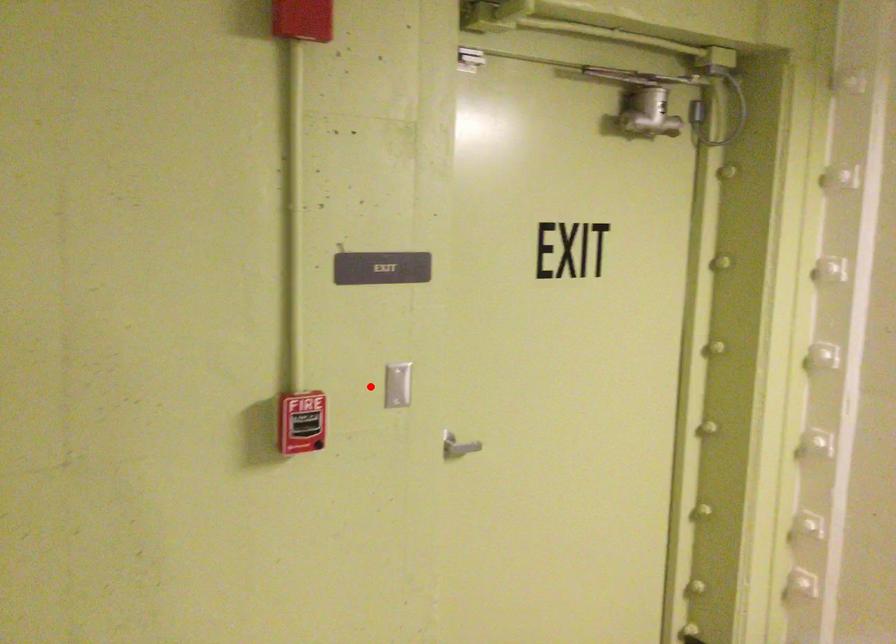
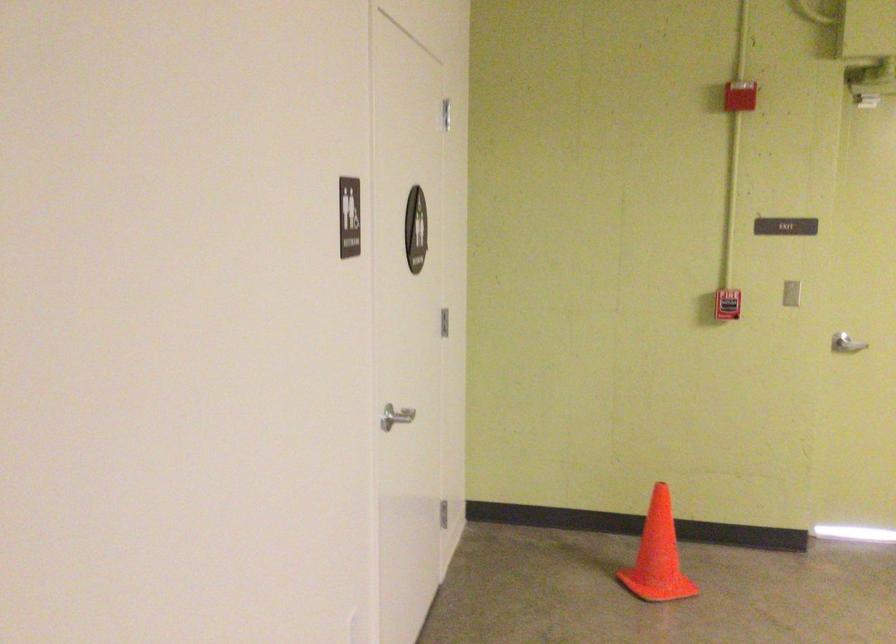
Where in the second image is the point corresponding to the highlighted location from the first image?

(790, 292)